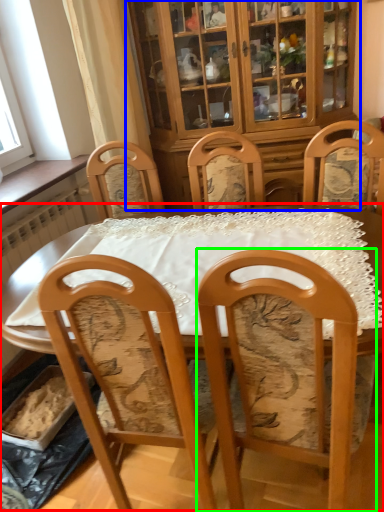
Question: Considering the real-world distances, which object is closest to table (highlighted by a red box)? cabinetry (highlighted by a blue box) or chair (highlighted by a green box).

Choices:
 (A) cabinetry
 (B) chair

Answer: (B)